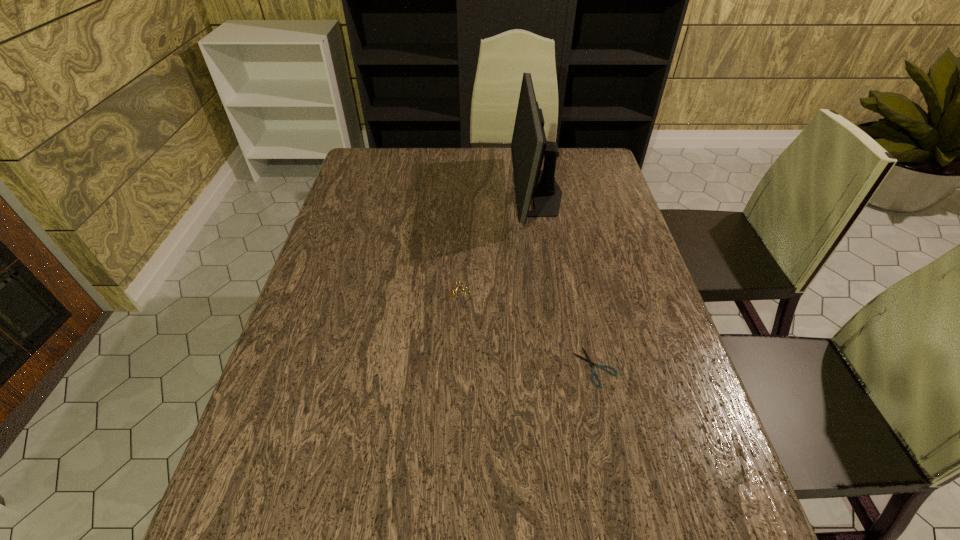
The height and width of the screenshot is (540, 960). Find the location of `the tallest object`. the tallest object is located at coordinates (529, 146).

You are a GUI agent. You are given a task and a screenshot of the screen. Output one action in this format:
    pyautogui.click(x=<x>, y=<y>)
    Task: Click on the farthest object
    
    Given the screenshot: What is the action you would take?
    pyautogui.click(x=529, y=146)

You are a GUI agent. You are given a task and a screenshot of the screen. Output one action in this format:
    pyautogui.click(x=<x>, y=<y>)
    Task: Click on the taller shears
    This screenshot has width=960, height=540.
    Given the screenshot: What is the action you would take?
    pyautogui.click(x=454, y=293)

Where is `the farther shears`? the farther shears is located at coordinates (454, 293).

The height and width of the screenshot is (540, 960). I want to click on the shortest object, so click(588, 360).

Identify the location of the nearer shears. (588, 360).

Where is `free point located 0.370m on the screen side of the farthest object`? The width and height of the screenshot is (960, 540). free point located 0.370m on the screen side of the farthest object is located at coordinates (398, 193).

Locate an element on the screen. free spot located 0.290m on the screen side of the farthest object is located at coordinates (423, 193).

The height and width of the screenshot is (540, 960). I want to click on vacant space located 0.370m on the screen side of the farthest object, so click(x=398, y=193).

Identify the location of vacant space located on the back of the leftmost object. This screenshot has width=960, height=540. tap(458, 226).